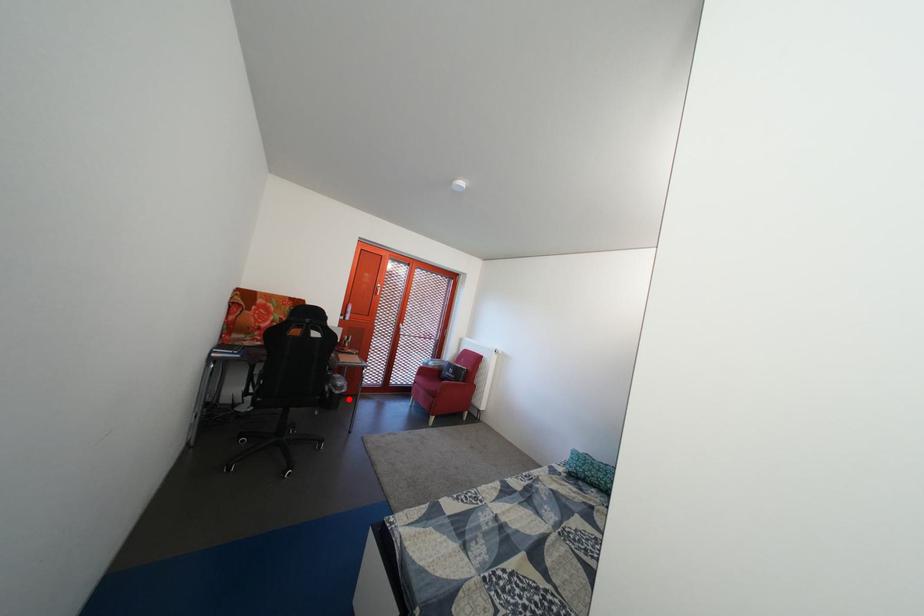
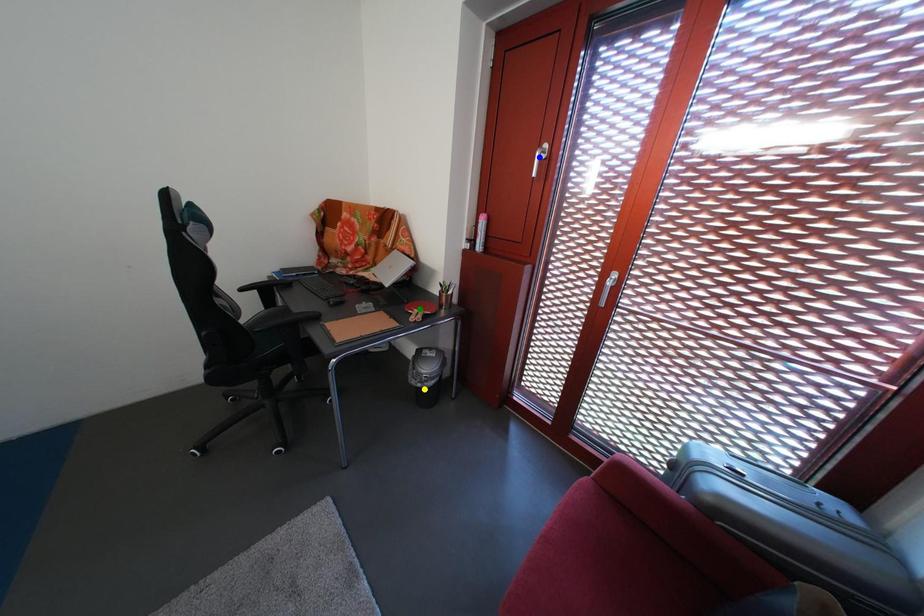
Question: I am providing you with two images of the same scene from different viewpoints. A red point is marked on the first image. You are given multiple points on the second image. Can you choose the point in image 2 that corresponds to the point in image 1?

Choices:
 (A) green point
 (B) blue point
 (C) yellow point

Answer: (C)